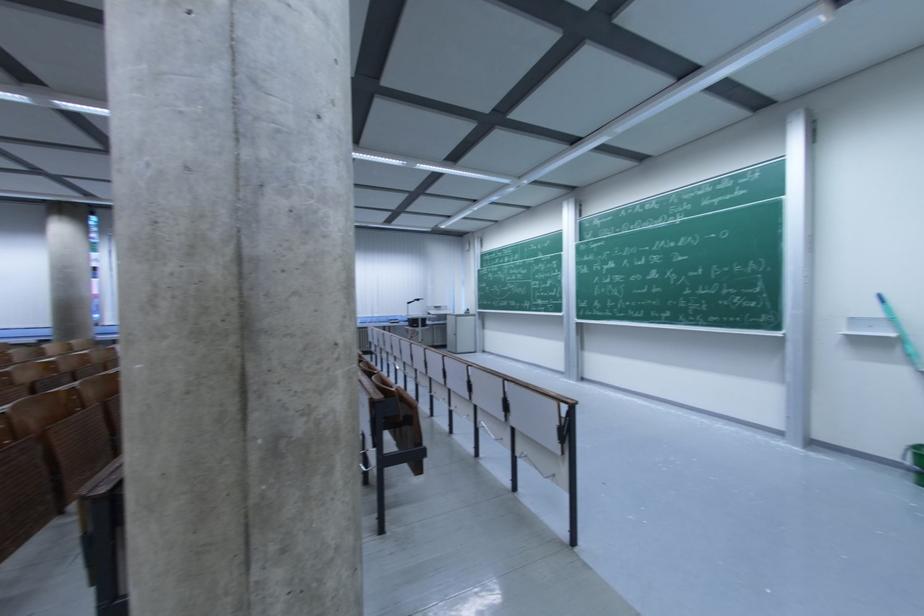
At what (x,y) coordinates should I click in order to perform the action: click on black desk lamp. Please return your answer as a coordinate pair (x, y). Looking at the image, I should click on (412, 301).